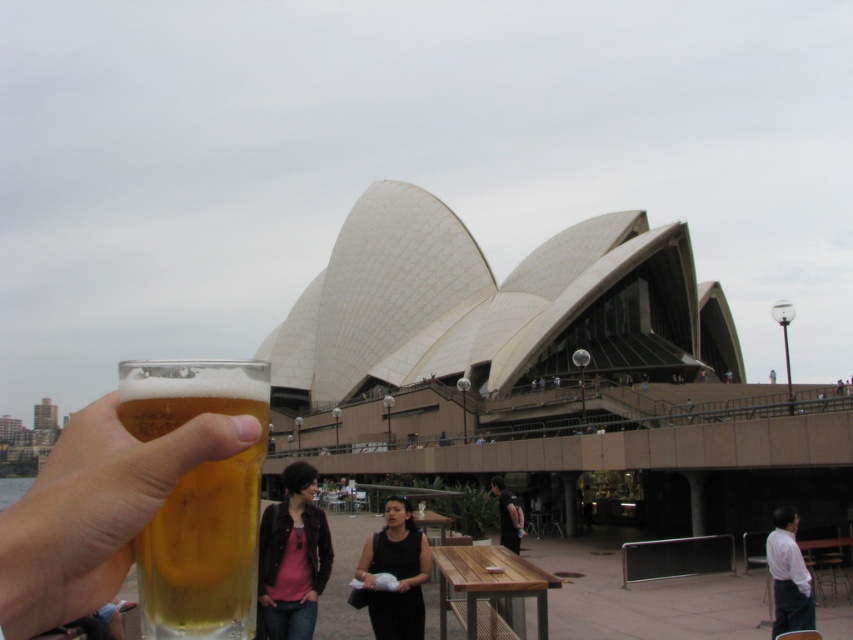
You are at the Sydney Opera House and notice two jackets hanging on a rack nearby. The matte black jacket at center and the dark gray fabric jacket at center. Which one is larger?

The matte black jacket at center is bigger than the dark gray fabric jacket at center.

Based on the scene description, where is the matte black jacket at center located in relation to the Sydney Opera House?

The matte black jacket at center is located at point (292, 557) in the image coordinates.

You are a photographer at the Sydney Opera House trying to capture a clear view of the building. You notice the golden glass beer at lower left and the dark gray fabric jacket at center in your frame. Which object is blocking your view of the Opera House, and why?

The golden glass beer at lower left is above the dark gray fabric jacket at center, meaning it is closer to the camera. Therefore, the golden glass beer at lower left is blocking the view of the Opera House because it is positioned in front of the jacket and closer to the camera.